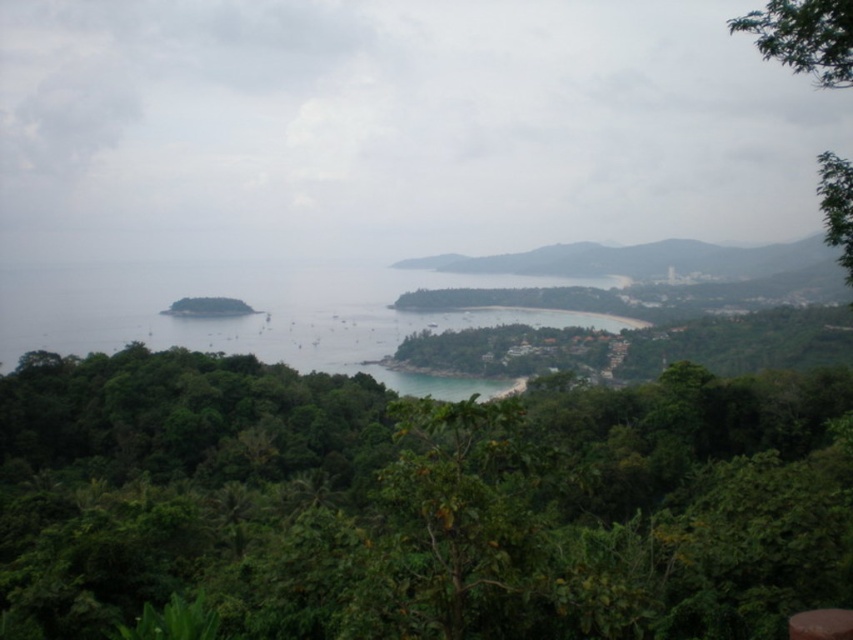
Question: Which of the following is the closest to the observer?

Choices:
 (A) green leafy tree at center
 (B) green leafy tree at upper right
 (C) green leafy hillside at center

Answer: (A)

Question: Which point is farther to the camera?

Choices:
 (A) green leafy tree at center
 (B) green leafy tree at upper right
 (C) green leafy hillside at center

Answer: (C)

Question: Considering the relative positions of green leafy tree at center and green leafy hillside at center in the image provided, where is green leafy tree at center located with respect to green leafy hillside at center?

Choices:
 (A) right
 (B) left

Answer: (B)

Question: Which object appears farthest from the camera in this image?

Choices:
 (A) green leafy tree at upper right
 (B) green leafy hillside at center
 (C) green leafy tree at center

Answer: (B)

Question: Observing the image, what is the correct spatial positioning of green leafy hillside at center in reference to green leafy tree at upper right?

Choices:
 (A) below
 (B) above

Answer: (A)

Question: Where is green leafy tree at center located in relation to green leafy hillside at center in the image?

Choices:
 (A) below
 (B) above

Answer: (A)